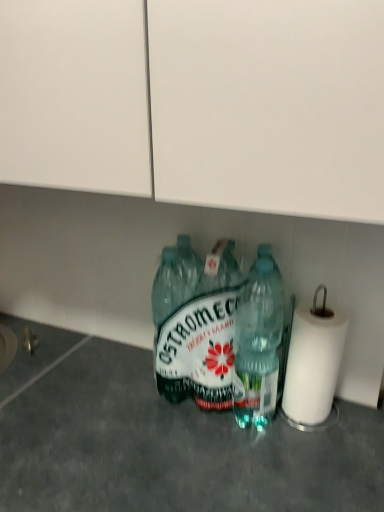
Find the location of a particular element. The image size is (384, 512). blank space to the left of translucent plastic bottle at center, acting as the 2th bottle starting from the left is located at coordinates (167, 442).